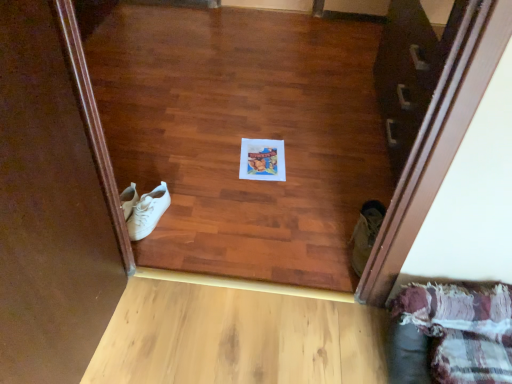
Find the location of a particular element. Image resolution: width=512 pixels, height=384 pixels. vacant space behind white leather sneakers at left, acting as the 2th footwear starting from the right is located at coordinates (172, 183).